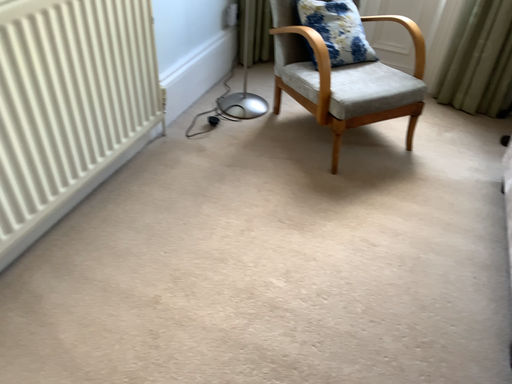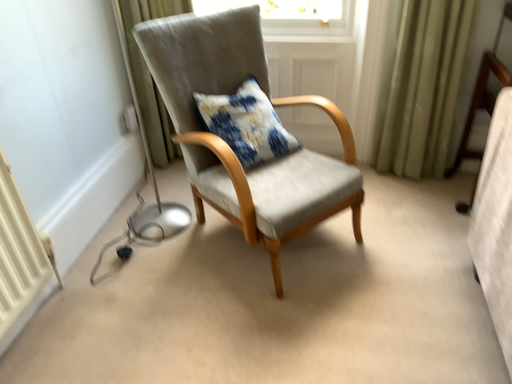
Question: Which way did the camera rotate in the video?

Choices:
 (A) rotated upward
 (B) rotated downward

Answer: (A)